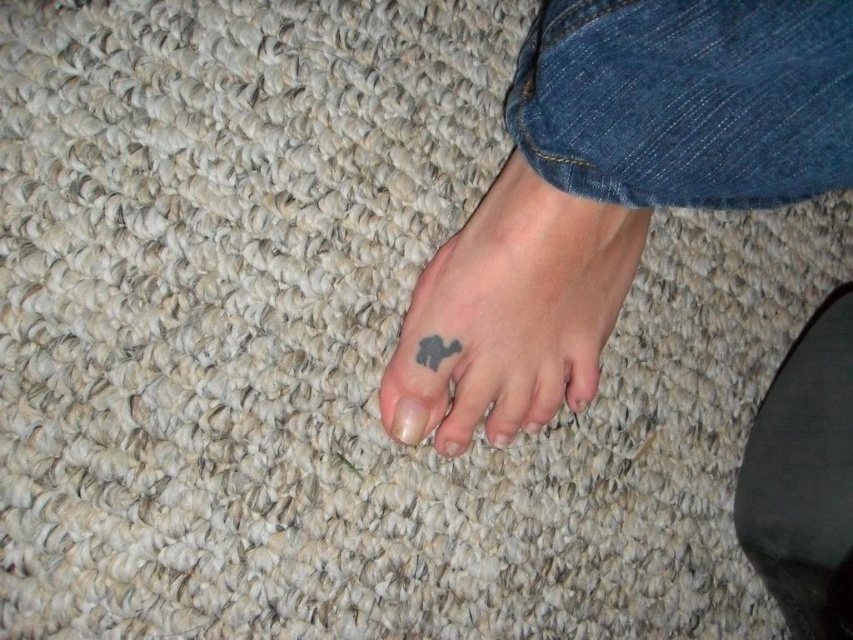
Question: Which of the following is the farthest from the observer?

Choices:
 (A) black matte tattoo at lower left
 (B) black rubber sandal at lower right
 (C) matte gray nail at center

Answer: (C)

Question: Does black matte tattoo at lower left appear on the left side of black ink tattoo at lower center?

Choices:
 (A) no
 (B) yes

Answer: (A)

Question: Among these objects, which one is nearest to the camera?

Choices:
 (A) matte gray nail at center
 (B) black matte tattoo at lower left

Answer: (B)

Question: Which of the following is the farthest from the observer?

Choices:
 (A) (824, 316)
 (B) (653, 88)
 (C) (428, 426)
 (D) (526, 316)

Answer: (A)

Question: Considering the relative positions of black matte tattoo at lower left and matte gray nail at center in the image provided, where is black matte tattoo at lower left located with respect to matte gray nail at center?

Choices:
 (A) right
 (B) left

Answer: (A)

Question: Does black matte tattoo at lower left appear on the left side of black rubber sandal at lower right?

Choices:
 (A) no
 (B) yes

Answer: (B)